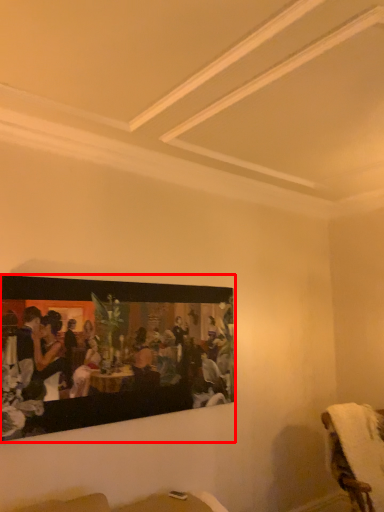
Question: From the image, what is the correct spatial relationship of picture frame (annotated by the red box) in relation to furniture?

Choices:
 (A) right
 (B) left

Answer: (B)